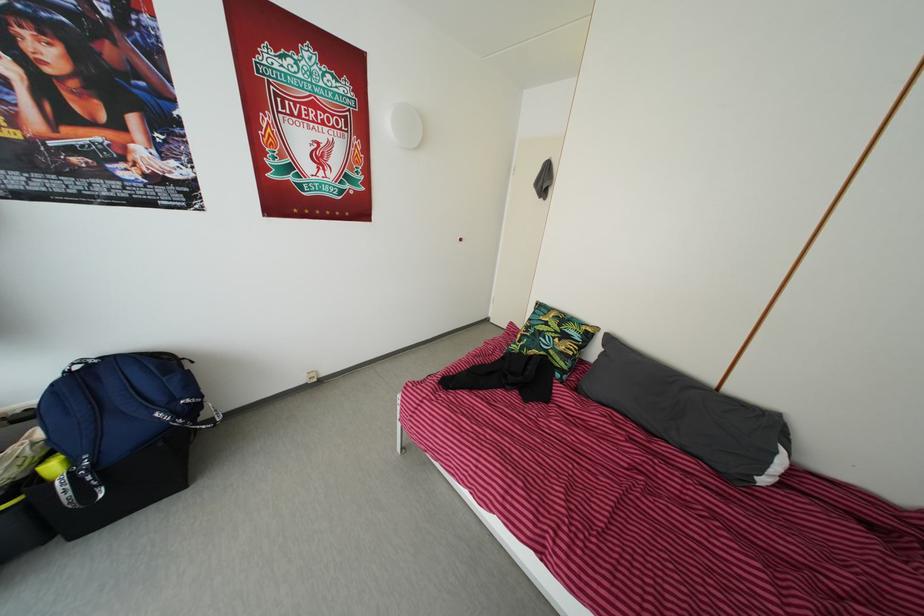
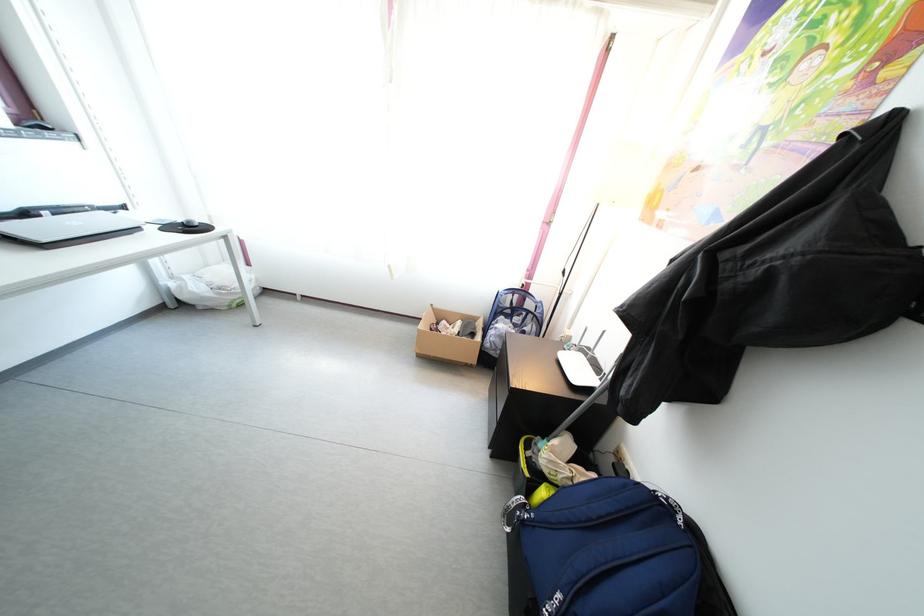
Locate, in the second image, the point that corresponds to (x=58, y=475) in the first image.

(550, 501)